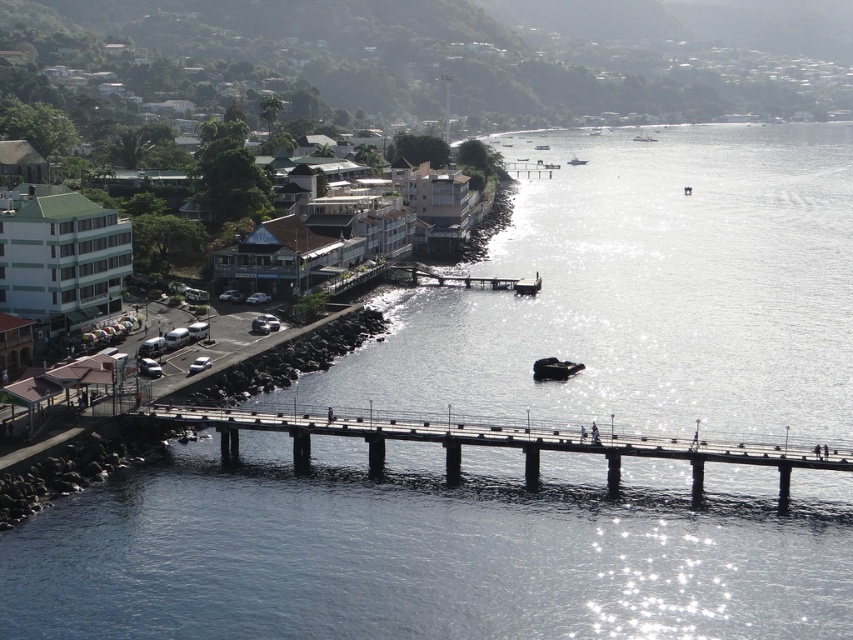
Question: Is the position of white plastic boat at center more distant than that of metallic gray boat at center?

Choices:
 (A) yes
 (B) no

Answer: (B)

Question: Which object is closer to the camera taking this photo?

Choices:
 (A) white plastic boat at center
 (B) metallic gray boat at center
 (C) smooth concrete bridge at center
 (D) dark blue rubber boat at center

Answer: (C)

Question: Which point is farther to the camera?

Choices:
 (A) white plastic boat at center
 (B) dark blue rubber boat at center
 (C) metallic gray boat at center

Answer: (C)

Question: Which point is farther to the camera?

Choices:
 (A) metallic gray boat at center
 (B) smooth concrete bridge at center
 (C) white plastic boat at center

Answer: (A)

Question: Does white plastic boat at center appear on the right side of metallic gray boat at center?

Choices:
 (A) no
 (B) yes

Answer: (A)

Question: Is smooth concrete bridge at center further to camera compared to dark blue rubber boat at center?

Choices:
 (A) yes
 (B) no

Answer: (B)